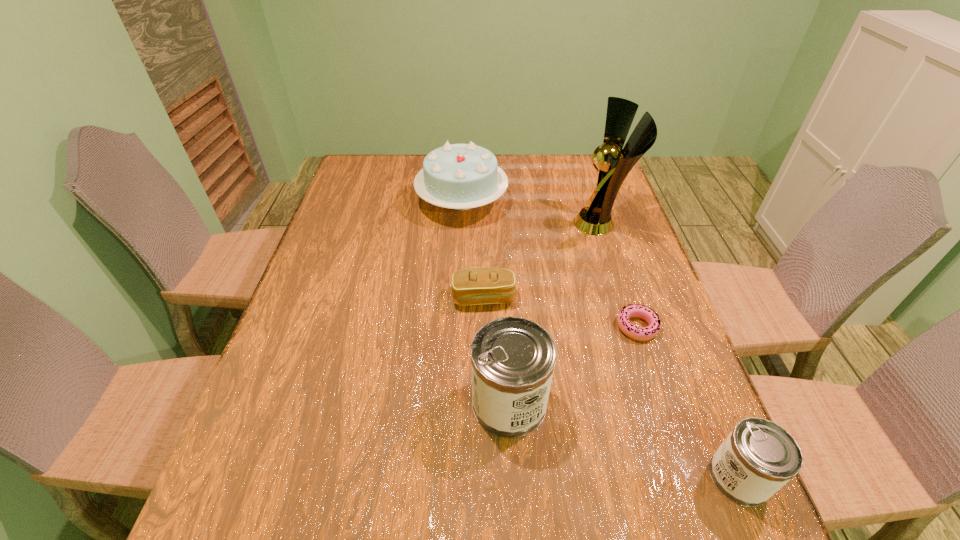
At what (x,y) coordinates should I click in order to perform the action: click on the left can. Please return your answer as a coordinate pair (x, y). The height and width of the screenshot is (540, 960). Looking at the image, I should click on (513, 358).

Where is `the farther can`? The width and height of the screenshot is (960, 540). the farther can is located at coordinates (513, 358).

The image size is (960, 540). In order to click on the nearest object in this screenshot , I will do `click(758, 457)`.

At what (x,y) coordinates should I click in order to perform the action: click on the shorter can. Please return your answer as a coordinate pair (x, y). Image resolution: width=960 pixels, height=540 pixels. Looking at the image, I should click on (758, 457).

Identify the location of birthday cake. (459, 176).

In order to click on doughnut in this screenshot , I will do `click(645, 313)`.

I want to click on the shortest object, so click(645, 313).

The height and width of the screenshot is (540, 960). In order to click on the tallest object in this screenshot , I will do `click(615, 162)`.

Where is `the fourth nearest object`? The width and height of the screenshot is (960, 540). the fourth nearest object is located at coordinates (483, 285).

Identify the location of clutch bag. (483, 285).